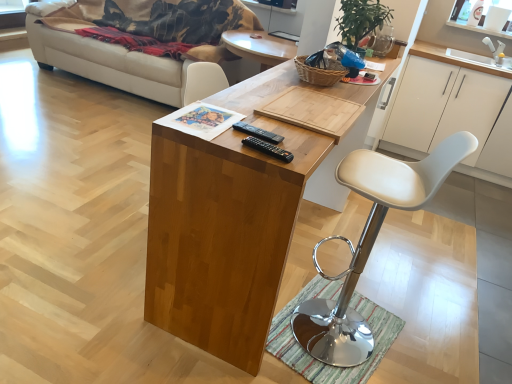
Identify the location of free space on the front side of beige fabric couch at left. The height and width of the screenshot is (384, 512). (78, 129).